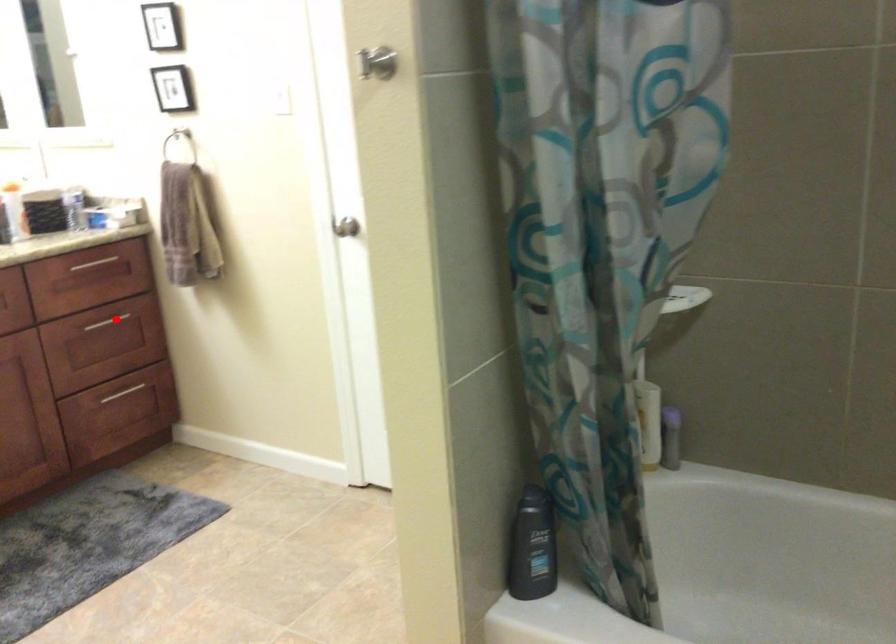
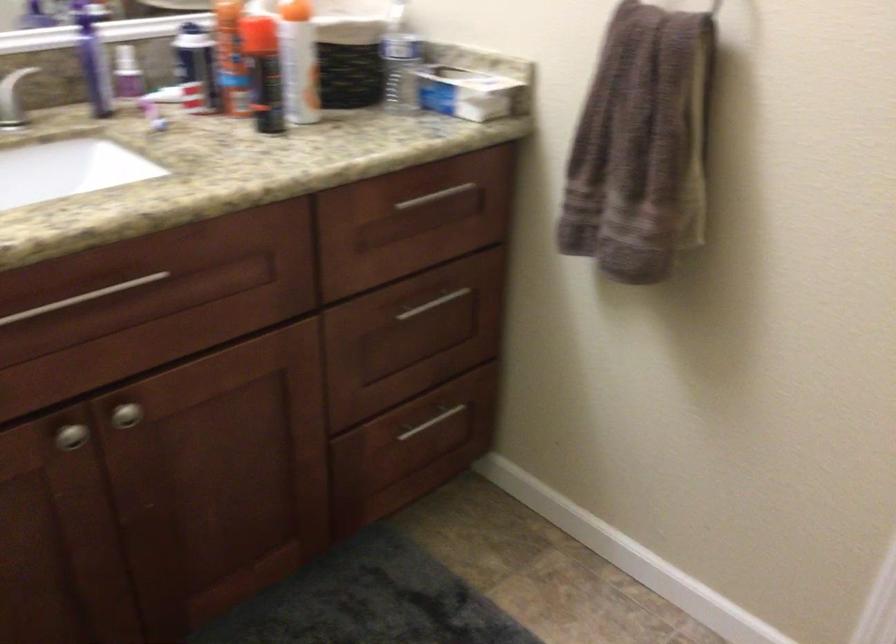
Question: I am providing you with two images of the same scene from different viewpoints. In image1, a red point is highlighted. Considering the same 3D point in image2, which of the following is correct?

Choices:
 (A) It is closer
 (B) It is farther

Answer: (A)